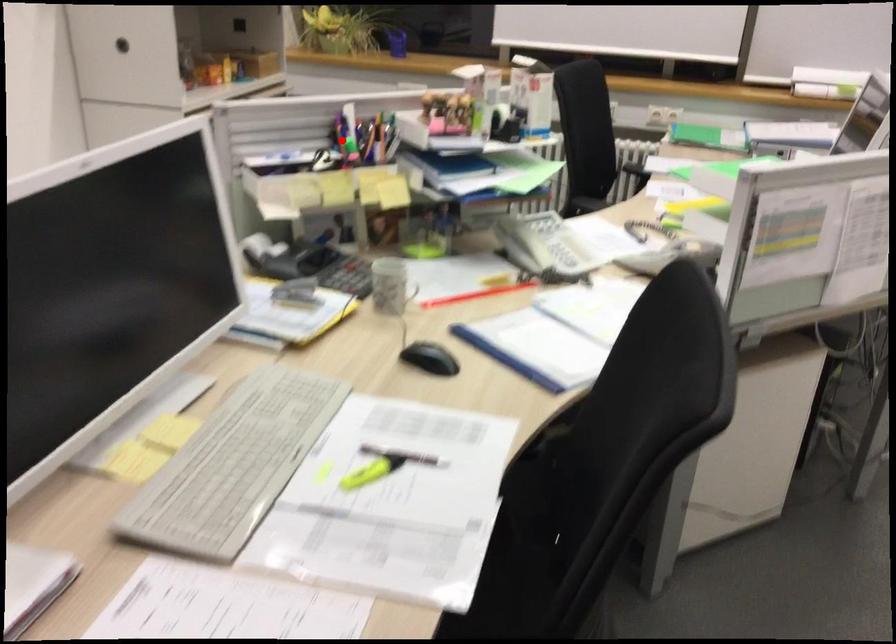
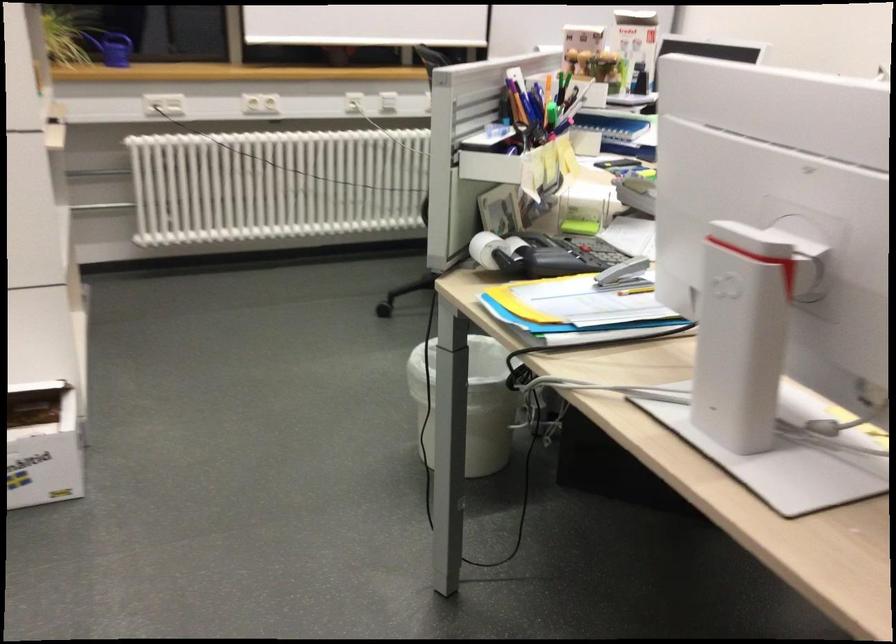
Question: I am providing you with two images of the same scene from different viewpoints. Image1 has a red point marked. In image2, the corresponding 3D location appears at what relative position? Reply with the corresponding letter.

Choices:
 (A) Closer
 (B) Farther

Answer: (A)